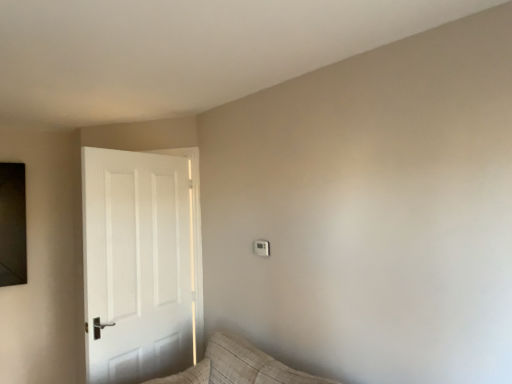
Question: Based on their sizes in the image, would you say white matte door at left is bigger or smaller than white plastic light switch at upper center?

Choices:
 (A) big
 (B) small

Answer: (A)

Question: Relative to white plastic light switch at upper center, is white matte door at left in front or behind?

Choices:
 (A) front
 (B) behind

Answer: (A)

Question: Which is correct: white matte door at left is inside white plastic light switch at upper center, or outside of it?

Choices:
 (A) inside
 (B) outside

Answer: (B)

Question: Is white plastic light switch at upper center situated inside white matte door at left or outside?

Choices:
 (A) inside
 (B) outside

Answer: (B)

Question: Is white plastic light switch at upper center in front of or behind white matte door at left in the image?

Choices:
 (A) front
 (B) behind

Answer: (B)

Question: Is white plastic light switch at upper center bigger or smaller than white matte door at left?

Choices:
 (A) big
 (B) small

Answer: (B)

Question: Considering the positions of white plastic light switch at upper center and white matte door at left in the image, is white plastic light switch at upper center taller or shorter than white matte door at left?

Choices:
 (A) short
 (B) tall

Answer: (A)